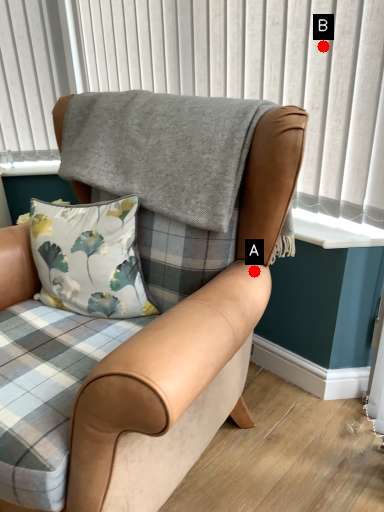
Question: Two points are circled on the image, labeled by A and B beside each circle. Among these points, which one is nearest to the camera?

Choices:
 (A) A is closer
 (B) B is closer

Answer: (A)